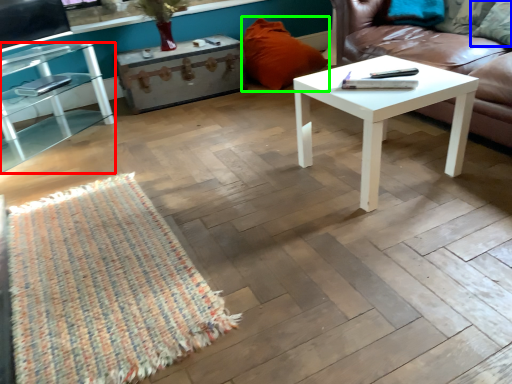
Question: Which object is the farthest from table (highlighted by a red box)? Choose among these: pillow (highlighted by a blue box) or pillow (highlighted by a green box).

Choices:
 (A) pillow
 (B) pillow

Answer: (A)